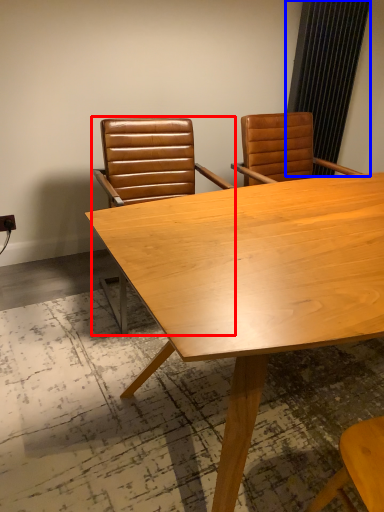
Question: Which of the following is the closest to the observer, chair (highlighted by a red box) or curtain (highlighted by a blue box)?

Choices:
 (A) chair
 (B) curtain

Answer: (A)